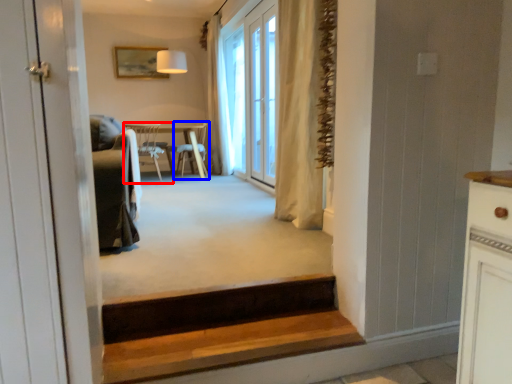
Question: Which object is closer to the camera taking this photo, chair (highlighted by a red box) or chair (highlighted by a blue box)?

Choices:
 (A) chair
 (B) chair

Answer: (A)